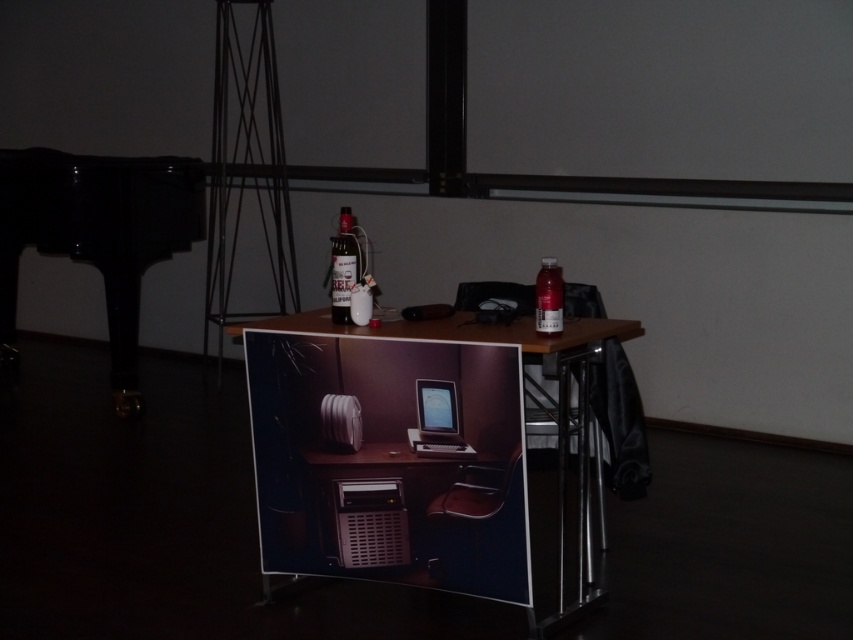
Does wooden desk at center have a lesser height compared to matte black tablet at center?

No.

Can you confirm if wooden desk at center is positioned below matte black tablet at center?

Correct, wooden desk at center is located below matte black tablet at center.

Which is behind, point (302, 476) or point (447, 396)?

Positioned behind is point (302, 476).

At what (x,y) coordinates should I click in order to perform the action: click on wooden desk at center. Please return your answer as a coordinate pair (x, y). The height and width of the screenshot is (640, 853). Looking at the image, I should click on (410, 451).

Is translucent glass bottle at center positioned before metallic black chair at center?

Yes, it is.

Is translucent glass bottle at center taller than metallic black chair at center?

Yes.

Between point (343, 260) and point (573, 310), which one is positioned behind?

Positioned behind is point (573, 310).

Find the location of a particular element. The width and height of the screenshot is (853, 640). translucent glass bottle at center is located at coordinates (343, 266).

Which of these two, brown leather chair at center or matte black tablet at center, stands shorter?

With less height is matte black tablet at center.

Is brown leather chair at center in front of matte black tablet at center?

Yes, brown leather chair at center is closer to the viewer.

Between point (447, 499) and point (416, 394), which one is positioned in front?

Point (416, 394) is in front.

Locate an element on the screen. This screenshot has height=640, width=853. brown leather chair at center is located at coordinates (474, 496).